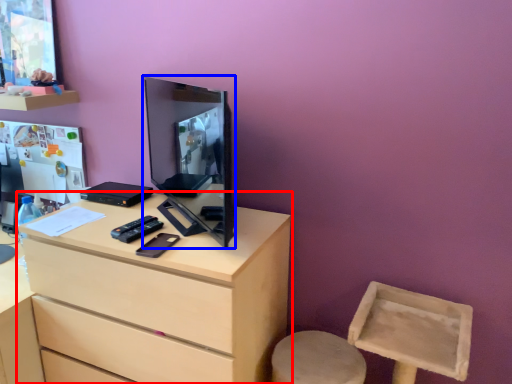
Question: Among these objects, which one is nearest to the camera, chest of drawers (highlighted by a red box) or computer monitor (highlighted by a blue box)?

Choices:
 (A) chest of drawers
 (B) computer monitor

Answer: (B)